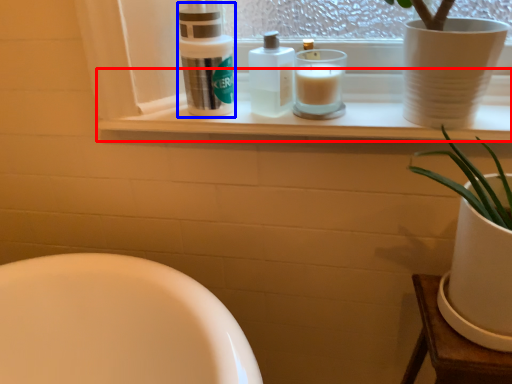
Question: Which of the following is the closest to the observer, window sill (highlighted by a red box) or cleaning product (highlighted by a blue box)?

Choices:
 (A) window sill
 (B) cleaning product

Answer: (A)